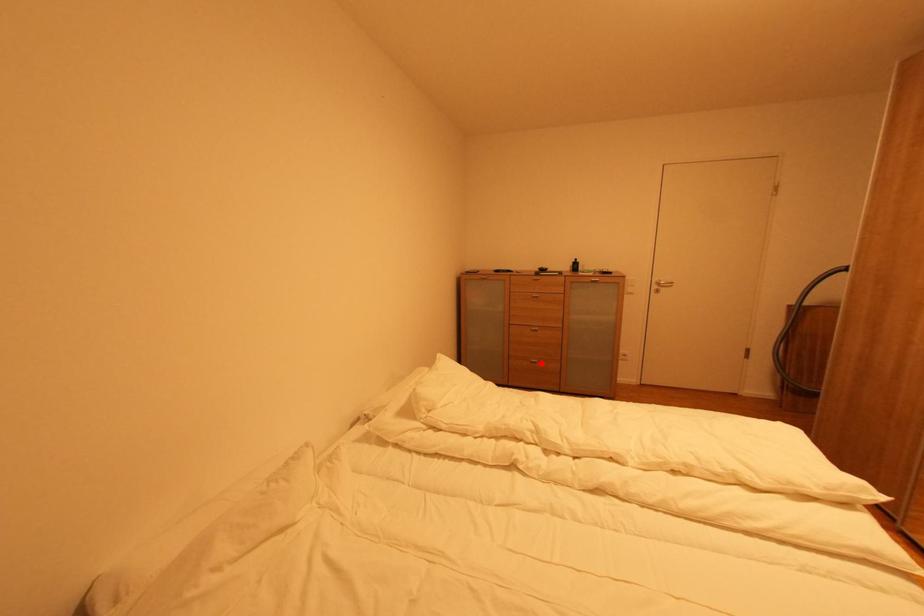
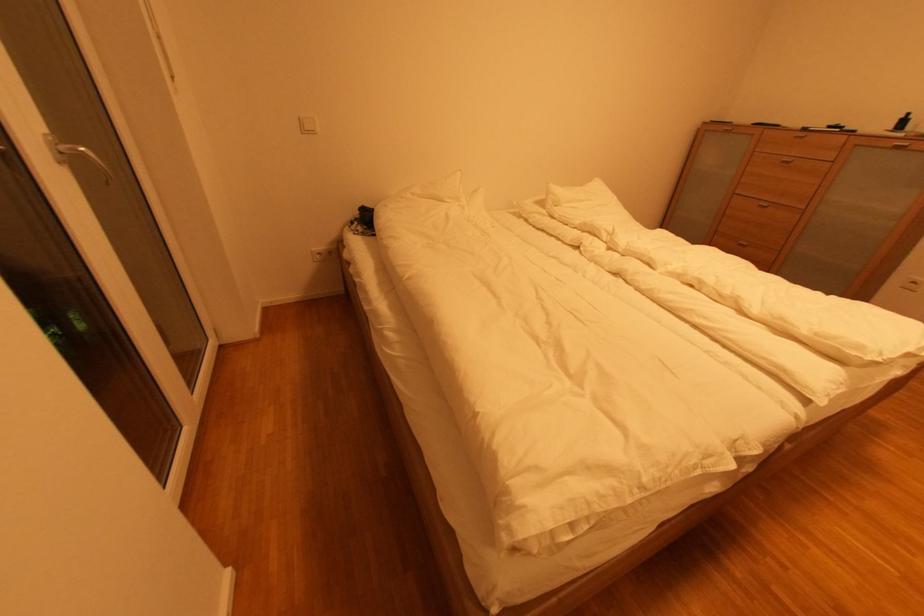
Where in the second image is the point corresponding to the highlighted location from the first image?

(749, 246)